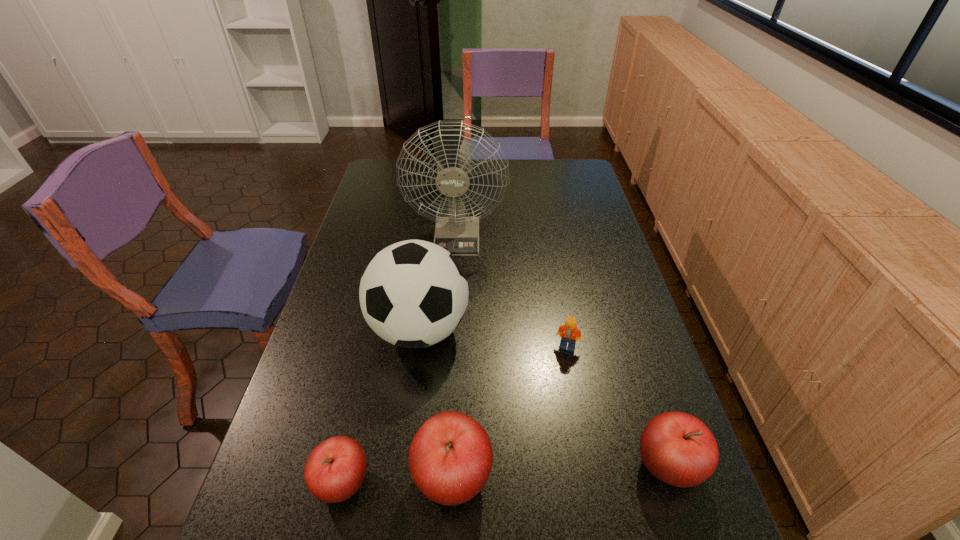
Image resolution: width=960 pixels, height=540 pixels. I want to click on blank area at the near edge, so click(x=564, y=505).

Where is `vacant area at the left edge`? vacant area at the left edge is located at coordinates (389, 213).

This screenshot has width=960, height=540. I want to click on free location at the right edge, so click(x=582, y=260).

Find the location of a particular element. This screenshot has width=960, height=540. free point between the second apple from right to left and the second tallest object is located at coordinates (436, 403).

In order to click on free space between the shortest apple and the second apple from left to right in this screenshot , I will do `click(397, 480)`.

Find the location of a particular element. Image resolution: width=960 pixels, height=540 pixels. vacant space that's between the soccer ball and the fourth tallest object is located at coordinates (543, 398).

Identify the location of vacant area that lies between the rightmost object and the farthest object. (563, 351).

This screenshot has width=960, height=540. In order to click on unoccupied area between the rightmost object and the second apple from left to right in this screenshot , I will do `click(561, 472)`.

Find the location of `blank region between the second tallest apple and the fan`. blank region between the second tallest apple and the fan is located at coordinates (563, 351).

Locate an element on the screen. unoccupied area between the soccer ball and the leftmost apple is located at coordinates (381, 406).